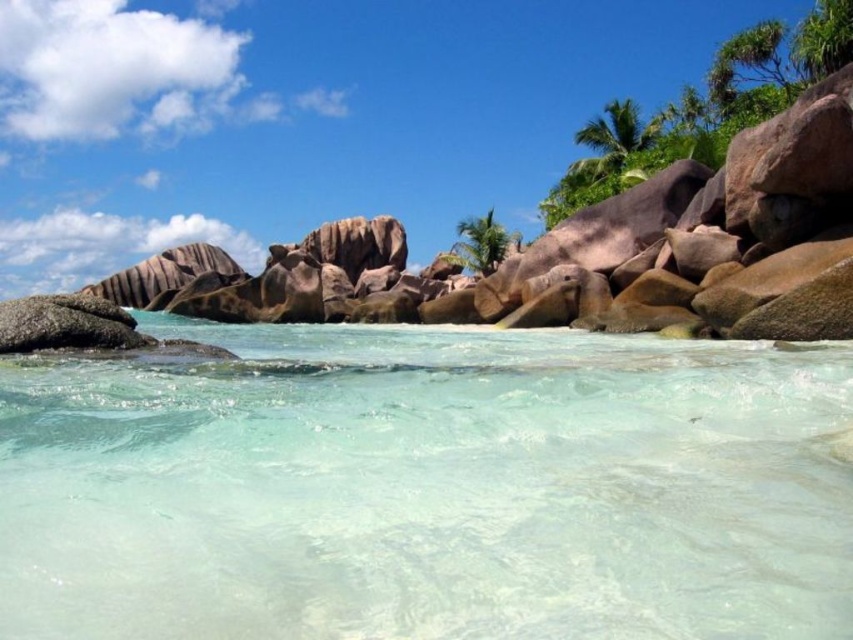
Question: Is clear water at center to the right of green leafy palm tree at upper right from the viewer's perspective?

Choices:
 (A) yes
 (B) no

Answer: (B)

Question: Which point is closer to the camera?

Choices:
 (A) brown granite rock formation at upper center
 (B) green leafy palm tree at upper right
 (C) green leafy palm tree at center
 (D) clear water at center

Answer: (D)

Question: Estimate the real-world distances between objects in this image. Which object is closer to the green leafy palm tree at center?

Choices:
 (A) brown granite rock formation at upper center
 (B) clear water at center

Answer: (A)

Question: Which point is farther to the camera?

Choices:
 (A) brown granite rock formation at upper center
 (B) green leafy palm tree at upper right

Answer: (B)

Question: Observing the image, what is the correct spatial positioning of clear water at center in reference to brown granite rock formation at upper center?

Choices:
 (A) above
 (B) below

Answer: (B)

Question: Does green leafy palm tree at upper right have a lesser width compared to green leafy palm tree at center?

Choices:
 (A) yes
 (B) no

Answer: (B)